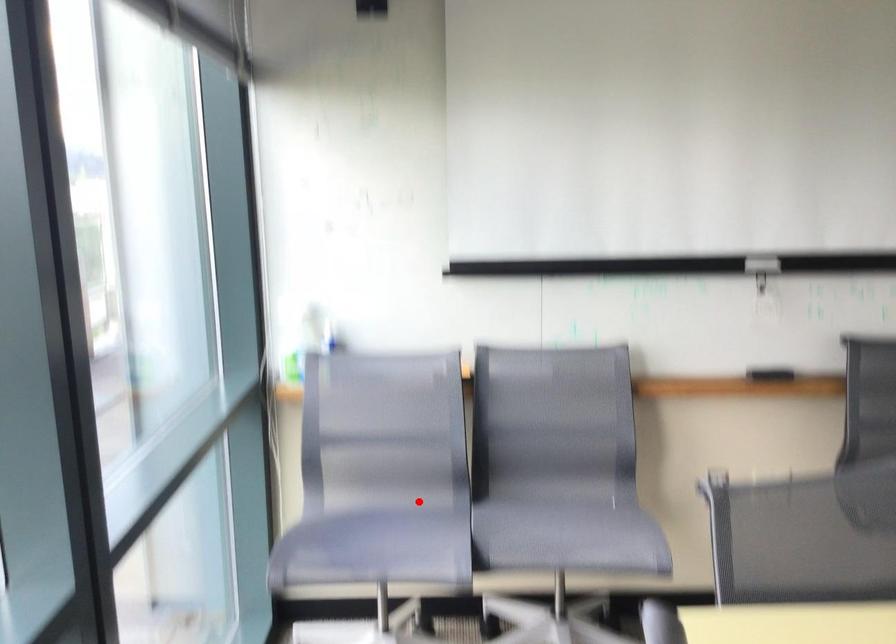
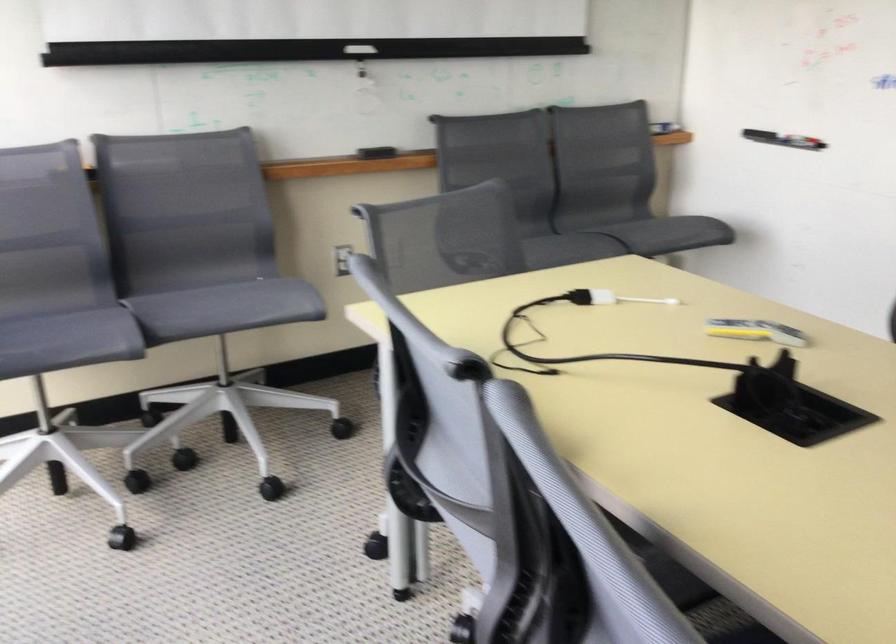
In the second image, find the point that corresponds to the highlighted location in the first image.

(58, 305)